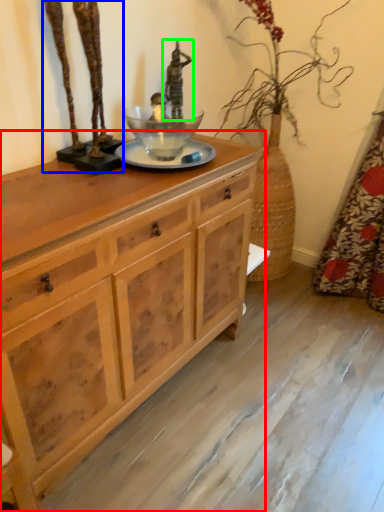
Question: Which is nearer to the chest of drawers (highlighted by a red box)? bronze statue (highlighted by a blue box) or sculpture (highlighted by a green box).

Choices:
 (A) bronze statue
 (B) sculpture

Answer: (A)